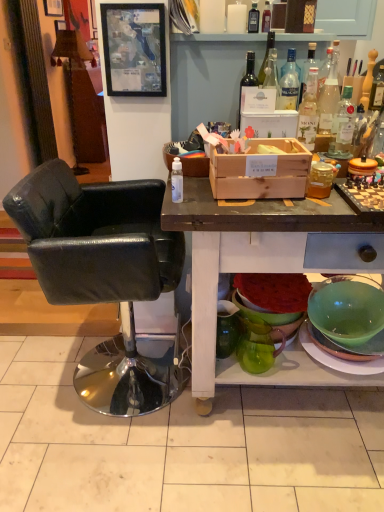
Question: In which direction should I rotate to look at matte black picture frame at upper center, positioned as the 1th picture frame in right-to-left order?

Choices:
 (A) right
 (B) left

Answer: (B)

Question: Is transparent plastic spray bottle at center, which appears as the 9th bottle when viewed from the right, next to matte black picture frame at upper center, the second picture frame positioned from the top, and touching it?

Choices:
 (A) no
 (B) yes

Answer: (A)

Question: Is matte black picture frame at upper center, marked as the second picture frame in a back-to-front arrangement, inside transparent plastic spray bottle at center, which is the 9th bottle from back to front?

Choices:
 (A) no
 (B) yes

Answer: (A)

Question: Is the position of transparent plastic spray bottle at center, which appears as the 9th bottle when viewed from the right, less distant than that of matte black picture frame at upper center, which appears as the first picture frame when ordered from the bottom?

Choices:
 (A) no
 (B) yes

Answer: (B)

Question: Considering the relative sizes of transparent plastic spray bottle at center, marked as the 1th bottle in a left-to-right arrangement, and matte black picture frame at upper center, the first picture frame positioned from the front, in the image provided, is transparent plastic spray bottle at center, marked as the 1th bottle in a left-to-right arrangement, thinner than matte black picture frame at upper center, the first picture frame positioned from the front,?

Choices:
 (A) no
 (B) yes

Answer: (A)

Question: From the image's perspective, is transparent plastic spray bottle at center, which is the 9th bottle from back to front, below matte black picture frame at upper center, marked as the second picture frame in a back-to-front arrangement?

Choices:
 (A) no
 (B) yes

Answer: (B)

Question: From a real-world perspective, is transparent plastic spray bottle at center, marked as the 1th bottle in a left-to-right arrangement, under matte black picture frame at upper center, marked as the second picture frame in a back-to-front arrangement?

Choices:
 (A) no
 (B) yes

Answer: (B)

Question: From a real-world perspective, is clear glass bottle at upper right, which ranks as the fourth bottle in back-to-front order, below clear glass bottle at upper right, the eighth bottle positioned from the back?

Choices:
 (A) yes
 (B) no

Answer: (B)

Question: Considering the relative sizes of clear glass bottle at upper right, the 7th bottle when ordered from left to right, and clear glass bottle at upper right, the eighth bottle positioned from the back, in the image provided, is clear glass bottle at upper right, the 7th bottle when ordered from left to right, wider than clear glass bottle at upper right, the eighth bottle positioned from the back,?

Choices:
 (A) yes
 (B) no

Answer: (B)

Question: Can you confirm if clear glass bottle at upper right, the 7th bottle when ordered from left to right, is bigger than clear glass bottle at upper right, the fifth bottle positioned from the right?

Choices:
 (A) no
 (B) yes

Answer: (A)

Question: From a real-world perspective, is clear glass bottle at upper right, acting as the 6th bottle starting from the front, physically above clear glass bottle at upper right, the 5th bottle when ordered from left to right?

Choices:
 (A) no
 (B) yes

Answer: (B)

Question: Considering the relative sizes of clear glass bottle at upper right, acting as the third bottle starting from the right, and clear glass bottle at upper right, the second bottle viewed from the front, in the image provided, is clear glass bottle at upper right, acting as the third bottle starting from the right, taller than clear glass bottle at upper right, the second bottle viewed from the front,?

Choices:
 (A) yes
 (B) no

Answer: (B)

Question: Is clear glass bottle at upper right, acting as the 6th bottle starting from the front, facing towards clear glass bottle at upper right, the 5th bottle when ordered from left to right?

Choices:
 (A) yes
 (B) no

Answer: (B)

Question: Is clear glass bottle at upper right, the 8th bottle when ordered from left to right, oriented away from transparent plastic spray bottle at center, marked as the 1th bottle in a left-to-right arrangement?

Choices:
 (A) no
 (B) yes

Answer: (A)